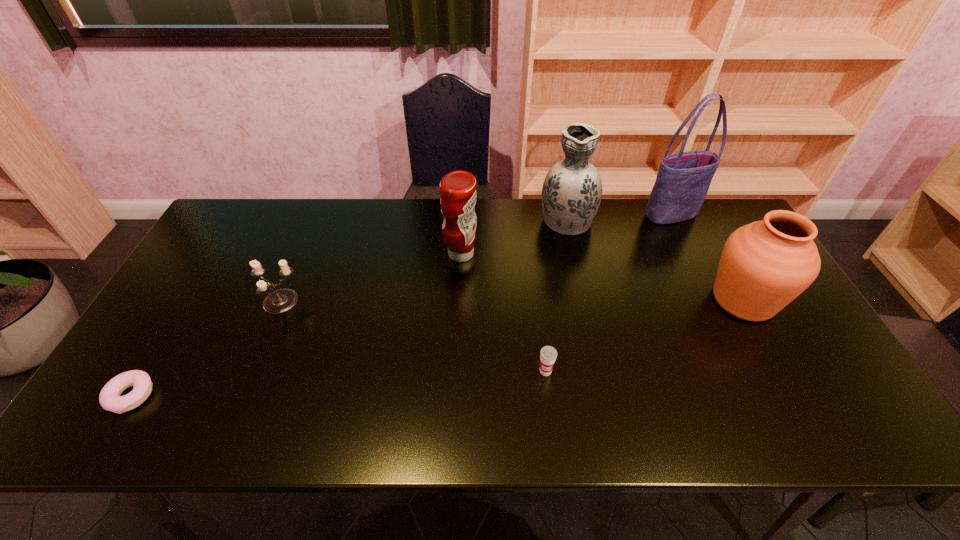
Locate an element on the screen. tote bag is located at coordinates (683, 180).

Locate an element on the screen. This screenshot has height=540, width=960. vase is located at coordinates (571, 194).

Where is `the second tallest object`? the second tallest object is located at coordinates [x=571, y=194].

At what (x,y) coordinates should I click in order to perform the action: click on urn. Please return your answer as a coordinate pair (x, y). Looking at the image, I should click on [765, 265].

The width and height of the screenshot is (960, 540). What are the coordinates of `the fifth nearest object` in the screenshot? It's located at (458, 188).

This screenshot has height=540, width=960. Find the location of `the third object from left to right`. the third object from left to right is located at coordinates (458, 188).

Identify the location of candle holder. The image size is (960, 540). (281, 300).

Where is `the second object from left to right`? Image resolution: width=960 pixels, height=540 pixels. the second object from left to right is located at coordinates (281, 300).

Identify the location of the sixth tallest object. (548, 354).

This screenshot has width=960, height=540. Identify the location of cup. (548, 354).